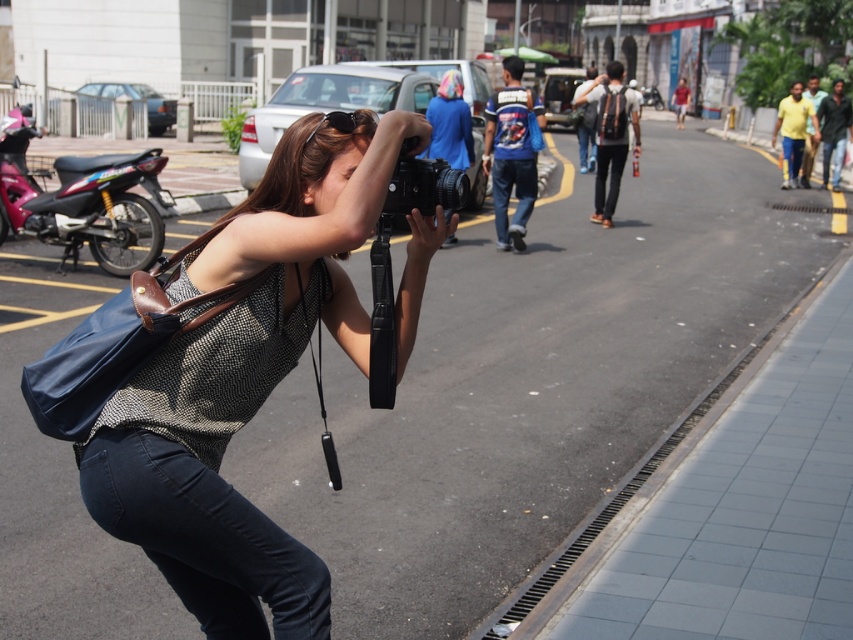
You are a photographer trying to adjust your equipment. You notice your matte black camera at center and your black plastic sunglasses at center. Which item is easier to reach without moving your arms too much?

The matte black camera at center is closer to the viewer than the black plastic sunglasses at center, so it is easier to reach without moving your arms too much.

You are a photographer who just arrived at the scene. You have a matte black camera at center and black plastic sunglasses at center. Which object should you pick up first if you want to start taking photos immediately?

You should pick up the matte black camera at center first because it is larger in size than the black plastic sunglasses at center, making it easier to handle and access quickly.